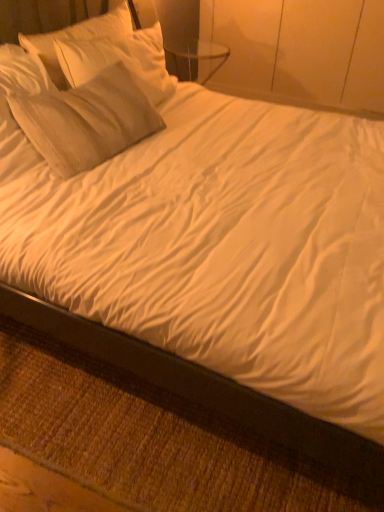
Question: Is black wood bed frame at lower left at the back of white soft pillow at upper left?

Choices:
 (A) no
 (B) yes

Answer: (A)

Question: Considering the relative sizes of white soft pillow at upper left and black wood bed frame at lower left in the image provided, is white soft pillow at upper left taller than black wood bed frame at lower left?

Choices:
 (A) no
 (B) yes

Answer: (B)

Question: From the image's perspective, is white soft pillow at upper left located beneath black wood bed frame at lower left?

Choices:
 (A) yes
 (B) no

Answer: (B)

Question: Would you say white soft pillow at upper left contains black wood bed frame at lower left?

Choices:
 (A) yes
 (B) no

Answer: (B)

Question: Is white soft pillow at upper left not inside black wood bed frame at lower left?

Choices:
 (A) yes
 (B) no

Answer: (A)

Question: From a real-world perspective, is white soft pillow at upper left on top of black wood bed frame at lower left?

Choices:
 (A) no
 (B) yes

Answer: (B)

Question: Is black wood bed frame at lower left not inside white soft pillow at upper left?

Choices:
 (A) no
 (B) yes

Answer: (B)

Question: From a real-world perspective, is black wood bed frame at lower left on top of white soft pillow at upper left?

Choices:
 (A) yes
 (B) no

Answer: (B)

Question: Is black wood bed frame at lower left bigger than white soft pillow at upper left?

Choices:
 (A) no
 (B) yes

Answer: (A)

Question: Is black wood bed frame at lower left taller than white soft pillow at upper left?

Choices:
 (A) yes
 (B) no

Answer: (B)

Question: Is black wood bed frame at lower left looking in the opposite direction of white soft pillow at upper left?

Choices:
 (A) no
 (B) yes

Answer: (A)

Question: Is black wood bed frame at lower left aimed at white soft pillow at upper left?

Choices:
 (A) no
 (B) yes

Answer: (A)

Question: In terms of height, does black wood bed frame at lower left look taller or shorter compared to white soft pillow at upper left?

Choices:
 (A) tall
 (B) short

Answer: (B)